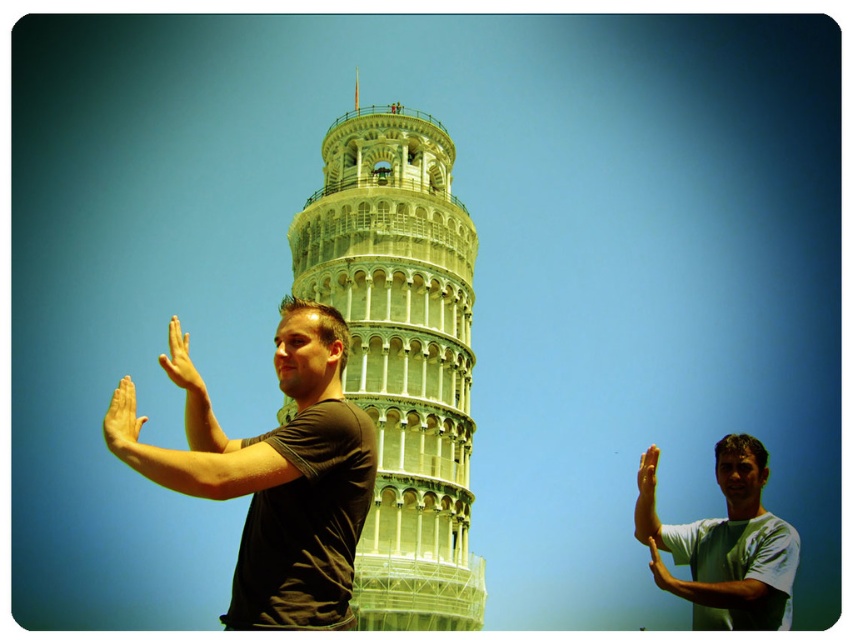
Question: Is black matte t-shirt at left bigger than green cotton shirt at center?

Choices:
 (A) yes
 (B) no

Answer: (B)

Question: Which point appears closest to the camera in this image?

Choices:
 (A) (664, 566)
 (B) (648, 476)

Answer: (B)

Question: Does green cotton shirt at center come in front of yellow matte hand at center?

Choices:
 (A) yes
 (B) no

Answer: (B)

Question: Which object is the farthest from the green stone tower at center?

Choices:
 (A) black matte t-shirt at left
 (B) green matte hand at right

Answer: (A)

Question: Is green cotton shirt at center above yellow matte hand at center?

Choices:
 (A) no
 (B) yes

Answer: (A)

Question: Which of the following is the closest to the observer?

Choices:
 (A) smooth skin hand at right
 (B) green stone tower at center
 (C) yellow matte hand at center
 (D) green cotton shirt at center

Answer: (C)